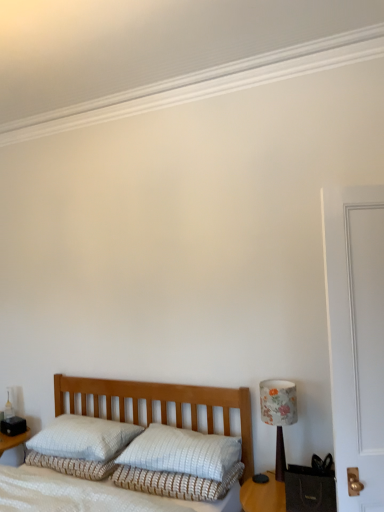
Locate an element on the screen. The image size is (384, 512). white textured pillow at center is located at coordinates (176, 483).

The width and height of the screenshot is (384, 512). What do you see at coordinates (84, 438) in the screenshot?
I see `white textured pillow at center, which is the 2th pillow from right to left` at bounding box center [84, 438].

The width and height of the screenshot is (384, 512). In order to click on white textured pillow at center in this screenshot , I will do [176, 483].

Looking at this image, in terms of width, does white textured bed at center look wider or thinner when compared to white textured pillow at center?

In the image, white textured bed at center appears to be wider than white textured pillow at center.

Who is shorter, white textured bed at center or white textured pillow at center?

With less height is white textured pillow at center.

From a real-world perspective, which is physically below, white textured bed at center or white textured pillow at center?

From a 3D spatial view, white textured bed at center is below.

Looking at this image, is white textured pillow at center, which appears as the 2th pillow when viewed from the left, aimed at wooden table at lower right?

No, white textured pillow at center, which appears as the 2th pillow when viewed from the left, is not turned towards wooden table at lower right.

Find the location of `table below the white textured pillow at center, which appears as the 2th pillow when viewed from the left (from a real-world perspective)`. table below the white textured pillow at center, which appears as the 2th pillow when viewed from the left (from a real-world perspective) is located at coordinates (290, 492).

From the image's perspective, is white textured pillow at center, which is the first pillow from right to left, on top of wooden table at lower right?

Yes, from the image's perspective, white textured pillow at center, which is the first pillow from right to left, is on top of wooden table at lower right.

How different are the orientations of white textured pillow at center, which appears as the 2th pillow when viewed from the left, and wooden table at lower right in degrees?

The facing directions of white textured pillow at center, which appears as the 2th pillow when viewed from the left, and wooden table at lower right are 4.58 degrees apart.

From the image's perspective, is floral fabric lampshade at right positioned above or below white textured pillow at center?

floral fabric lampshade at right is above white textured pillow at center.

In terms of width, does floral fabric lampshade at right look wider or thinner when compared to white textured pillow at center?

Considering their sizes, floral fabric lampshade at right looks slimmer than white textured pillow at center.

Are floral fabric lampshade at right and white textured pillow at center beside each other?

floral fabric lampshade at right is not next to white textured pillow at center, and they're not touching.

Is point (261, 498) closer or farther from the camera than point (110, 461)?

Point (261, 498) appears to be closer to the viewer than point (110, 461).

This screenshot has width=384, height=512. I want to click on bed on the left of wooden table at lower right, so click(x=133, y=452).

Is wooden table at lower right outside of white textured bed at center?

wooden table at lower right is positioned outside white textured bed at center.

From a real-world perspective, is wooden table at lower right located higher than white textured bed at center?

No, from a real-world perspective, wooden table at lower right is not over white textured bed at center

Is point (197, 485) closer or farther from the camera than point (240, 490)?

Point (197, 485) appears to be closer to the viewer than point (240, 490).

From the image's perspective, is white textured pillow at center under wooden table at lower right?

No, from the image's perspective, white textured pillow at center is not below wooden table at lower right.

Consider the image. Is white textured pillow at center not near wooden table at lower right?

No, white textured pillow at center is not far from wooden table at lower right.

Considering the positions of objects white textured pillow at center and wooden table at lower right in the image provided, who is more to the left, white textured pillow at center or wooden table at lower right?

white textured pillow at center.

Considering the relative sizes of white textured bed at center and floral fabric lampshade at right in the image provided, is white textured bed at center bigger than floral fabric lampshade at right?

Yes, white textured bed at center is bigger than floral fabric lampshade at right.

Considering the sizes of objects white textured bed at center and floral fabric lampshade at right in the image provided, who is thinner, white textured bed at center or floral fabric lampshade at right?

Thinner between the two is floral fabric lampshade at right.

Is white textured bed at center to the left or to the right of floral fabric lampshade at right in the image?

From the image, it's evident that white textured bed at center is to the left of floral fabric lampshade at right.

Is white textured bed at center completely or partially outside of floral fabric lampshade at right?

Absolutely, white textured bed at center is external to floral fabric lampshade at right.

From the image's perspective, is white textured bed at center above or below white textured pillow at center, which appears as the 2th pillow when viewed from the left?

Clearly, from the image's perspective, white textured bed at center is below white textured pillow at center, which appears as the 2th pillow when viewed from the left.

Considering the positions of points (158, 459) and (135, 442), is point (158, 459) closer to camera compared to point (135, 442)?

Yes, point (158, 459) is closer to viewer.

Could white textured pillow at center, which is the first pillow from right to left, be considered to be inside white textured bed at center?

Yes, white textured bed at center is surrounding white textured pillow at center, which is the first pillow from right to left.

Considering the relative sizes of white textured bed at center and white textured pillow at center, which appears as the 2th pillow when viewed from the left, in the image provided, is white textured bed at center bigger than white textured pillow at center, which appears as the 2th pillow when viewed from the left,?

Indeed, white textured bed at center has a larger size compared to white textured pillow at center, which appears as the 2th pillow when viewed from the left.

Where is `bedding that is above the white textured bed at center (from a real-world perspective)`? bedding that is above the white textured bed at center (from a real-world perspective) is located at coordinates (176, 483).

There is a wooden table at lower right. Identify the location of the 2nd pillow above it (from the image's perspective). (182, 452).

Which object lies nearer to the anchor point white textured pillow at center, which is the first pillow from right to left, floral fabric lampshade at right or white textured bed at center?

Among the two, white textured bed at center is located nearer to white textured pillow at center, which is the first pillow from right to left.

Based on the photo, estimate the real-world distances between objects in this image. Which object is closer to white textured pillow at center, which is the first pillow from right to left, white textured pillow at center, which is the 2th pillow from right to left, or white textured bed at center?

Based on the image, white textured bed at center appears to be nearer to white textured pillow at center, which is the first pillow from right to left.

When comparing their distances from white textured pillow at center, which is the 2th pillow from right to left, does floral fabric lampshade at right or white textured bed at center seem closer?

white textured bed at center is closer to white textured pillow at center, which is the 2th pillow from right to left.

Which object lies further to the anchor point white textured pillow at center, which is the 2th pillow from right to left, wooden table at lower right or white textured bed at center?

The object further to white textured pillow at center, which is the 2th pillow from right to left, is wooden table at lower right.

Considering their positions, is white textured pillow at center, placed as the 1th pillow when sorted from left to right, positioned further to white textured bed at center than white textured pillow at center, which is the first pillow from right to left?

white textured pillow at center, placed as the 1th pillow when sorted from left to right.

Based on their spatial positions, is wooden table at lower right or floral fabric lampshade at right closer to white textured pillow at center?

Among the two, wooden table at lower right is located nearer to white textured pillow at center.

Considering their positions, is floral fabric lampshade at right positioned closer to white textured pillow at center than wooden table at lower right?

wooden table at lower right lies closer to white textured pillow at center than the other object.

Looking at the image, which one is located further to white textured bed at center, white textured pillow at center or floral fabric lampshade at right?

Among the two, floral fabric lampshade at right is located further to white textured bed at center.

At what (x,y) coordinates should I click in order to perform the action: click on bedding situated between white textured pillow at center, placed as the 1th pillow when sorted from left to right, and floral fabric lampshade at right from left to right. Please return your answer as a coordinate pair (x, y). Looking at the image, I should click on (176, 483).

At what (x,y) coordinates should I click in order to perform the action: click on table located between white textured bed at center and white textured pillow at center, which is the 2th pillow from right to left, in the depth direction. Please return your answer as a coordinate pair (x, y). The height and width of the screenshot is (512, 384). Looking at the image, I should click on (290, 492).

What are the coordinates of `bedding between white textured pillow at center, which is the 2th pillow from right to left, and white textured pillow at center, which is the first pillow from right to left` in the screenshot? It's located at tap(176, 483).

Where is `table lamp between white textured pillow at center, which is the 2th pillow from right to left, and wooden table at lower right`? Image resolution: width=384 pixels, height=512 pixels. table lamp between white textured pillow at center, which is the 2th pillow from right to left, and wooden table at lower right is located at coordinates (278, 414).